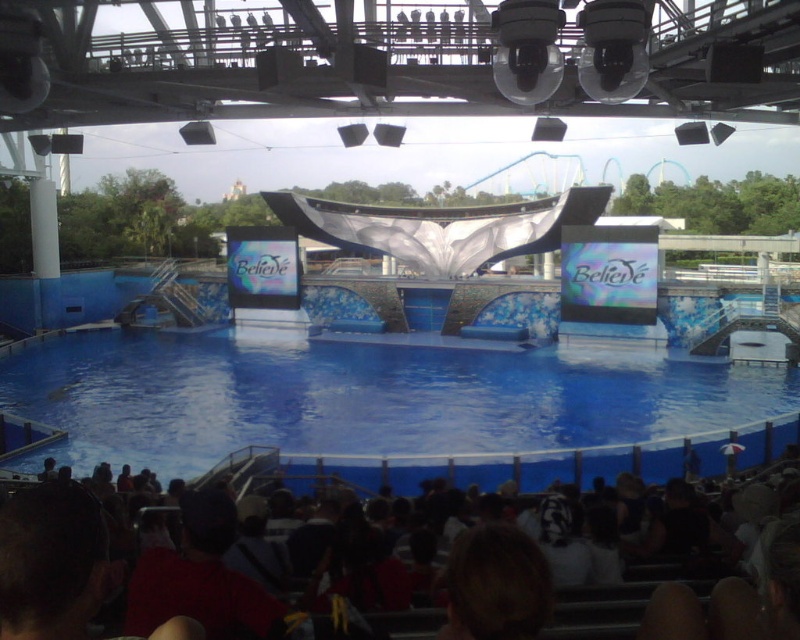
You are a photographer positioned at the camera location. You want to capture a closeup shot of the blue glossy water at center. Considering the distance, can you use a standard lens with a maximum focus range of 70 meters?

The blue glossy water at center is 71.64 meters away from the camera. Since the standard lens can only focus up to 70 meters, it won not be able to capture a clear closeup shot.

You are a stage designer planning to place a 1.2 meter wide decorative arch between the blue glossy water at center and the dark brown hair at lower center. Based on the scene description, will the space between them accommodate the arch?

The blue glossy water at center has a larger width than the dark brown hair at lower center. Since the arch is 1.2 meters wide, the space between them may be sufficient if the width difference allows it. However, without exact measurements of the space between them, it is uncertain whether the arch will fit.

You are a photographer standing at the back of the audience. You want to capture a photo of the dark brown hair at lower center without the blue glossy water at center appearing in the foreground. Is this possible based on their positions?

The blue glossy water at center is positioned over the dark brown hair at lower center, so the water would block the view of the hair from the photographer standing at the back of the audience. Therefore, it is not possible to capture the dark brown hair at lower center without the blue glossy water at center in the foreground.